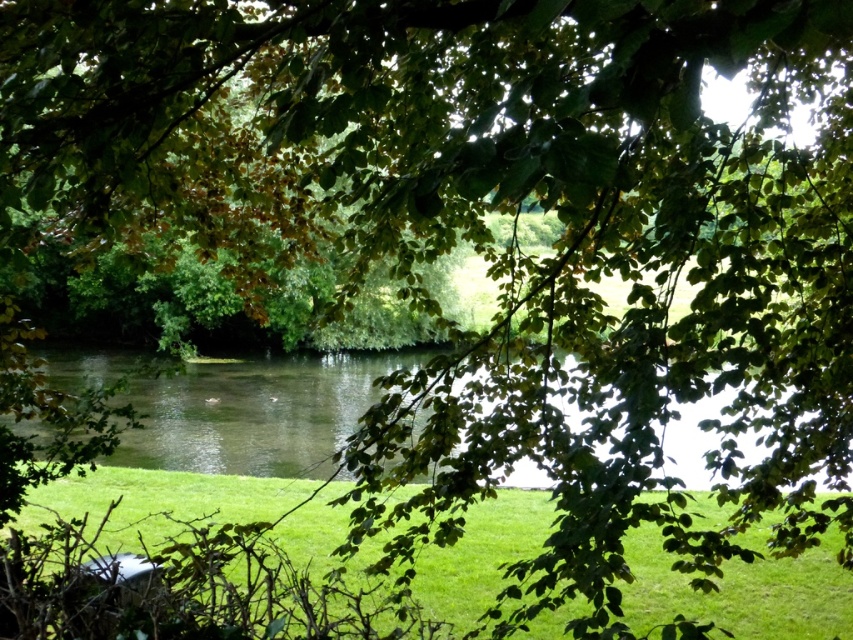
Who is taller, green grassy at lower center or clear water at center?

clear water at center is taller.

Identify the location of green grassy at lower center. (743, 592).